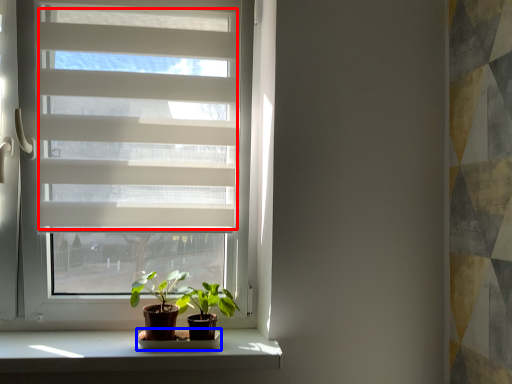
Question: Which object appears closest to the camera in this image, blind (highlighted by a red box) or shelf (highlighted by a blue box)?

Choices:
 (A) blind
 (B) shelf

Answer: (A)